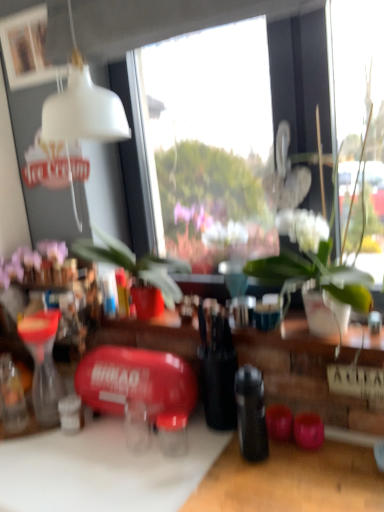
Question: Is white matte cutting board at lower left bigger than purple matte flowers at upper left?

Choices:
 (A) no
 (B) yes

Answer: (B)

Question: Is white matte cutting board at lower left outside purple matte flowers at upper left?

Choices:
 (A) yes
 (B) no

Answer: (A)

Question: Can you confirm if white matte cutting board at lower left is positioned to the left of purple matte flowers at upper left?

Choices:
 (A) no
 (B) yes

Answer: (A)

Question: Does white matte cutting board at lower left turn towards purple matte flowers at upper left?

Choices:
 (A) yes
 (B) no

Answer: (B)

Question: Considering the relative sizes of white matte cutting board at lower left and purple matte flowers at upper left in the image provided, is white matte cutting board at lower left wider than purple matte flowers at upper left?

Choices:
 (A) yes
 (B) no

Answer: (A)

Question: Is white matte cutting board at lower left taller than purple matte flowers at upper left?

Choices:
 (A) no
 (B) yes

Answer: (B)

Question: From a real-world perspective, is white glossy vase at center under white matte picture frame at upper left?

Choices:
 (A) yes
 (B) no

Answer: (A)

Question: Is white glossy vase at center at the right side of white matte picture frame at upper left?

Choices:
 (A) no
 (B) yes

Answer: (B)

Question: From the image's perspective, is white glossy vase at center over white matte picture frame at upper left?

Choices:
 (A) no
 (B) yes

Answer: (A)

Question: Is white glossy vase at center closer to the viewer compared to white matte picture frame at upper left?

Choices:
 (A) yes
 (B) no

Answer: (A)

Question: Is white glossy vase at center taller than white matte picture frame at upper left?

Choices:
 (A) no
 (B) yes

Answer: (B)

Question: From the image's perspective, would you say white glossy vase at center is shown under white matte picture frame at upper left?

Choices:
 (A) yes
 (B) no

Answer: (A)

Question: Can you confirm if white matte picture frame at upper left is positioned to the right of black matte bottle at center?

Choices:
 (A) no
 (B) yes

Answer: (A)